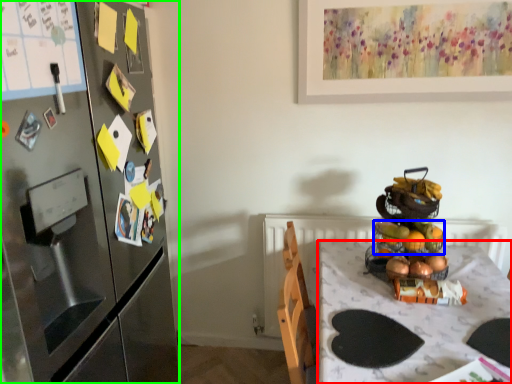
Question: Which object is the closest to the desk (highlighted by a red box)? Choose among these: basket (highlighted by a blue box) or cabinetry (highlighted by a green box).

Choices:
 (A) basket
 (B) cabinetry

Answer: (A)